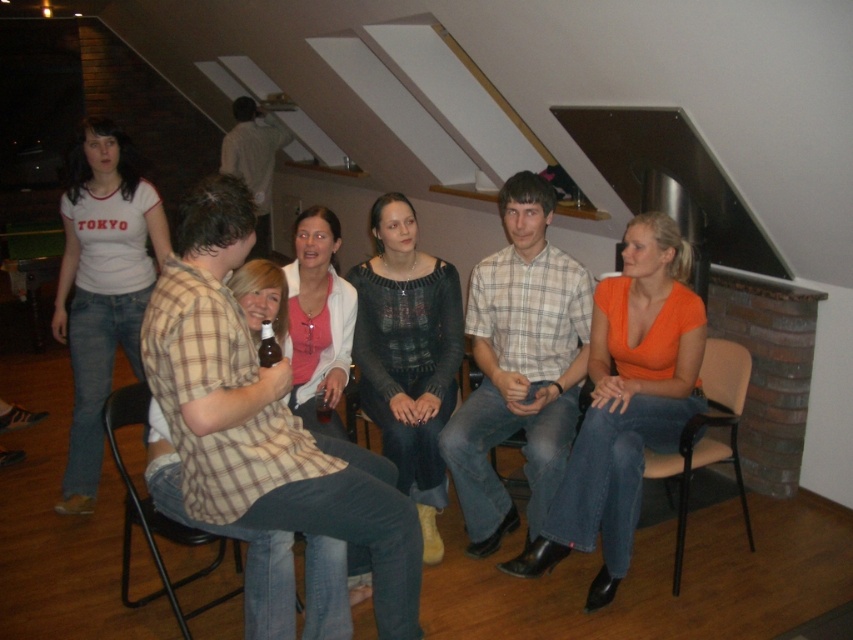
You are a photographer setting up for a group photo in this room. You notice the white matte shirt at left and the beige fabric chair at lower right. Which object should you position your camera closer to if you want to capture both in the same frame without moving the camera?

You should position your camera closer to the beige fabric chair at lower right because the white matte shirt at left is above it, so adjusting the camera angle downward will include both in the frame.

You are standing at the entrance of the room and want to find the orange matte shirt at center. Based on the seating arrangement, which direction should you look to locate it?

The orange matte shirt at center is located at point coordinates, so you should look towards the center of the room to find it.